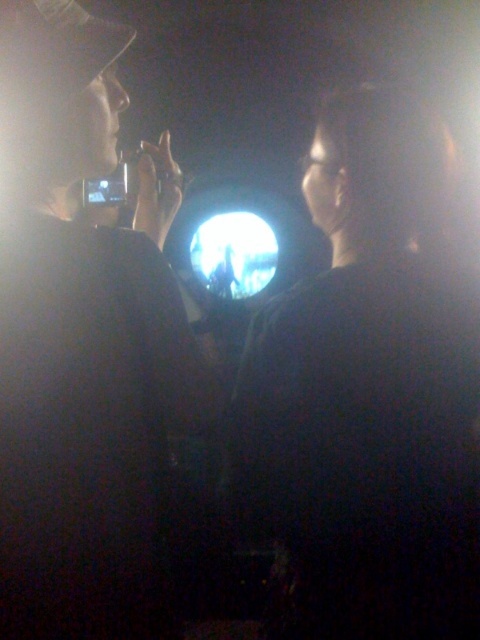
Question: Is black matte face at center wider than matte black phone at left?

Choices:
 (A) yes
 (B) no

Answer: (A)

Question: Which point is farther to the camera?

Choices:
 (A) black matte face at center
 (B) matte black phone at left

Answer: (A)

Question: Can you confirm if black matte face at center is wider than matte black phone at left?

Choices:
 (A) no
 (B) yes

Answer: (B)

Question: Is black matte face at center thinner than matte black phone at left?

Choices:
 (A) yes
 (B) no

Answer: (B)

Question: Which point appears farthest from the camera in this image?

Choices:
 (A) (82, 504)
 (B) (392, 148)

Answer: (B)